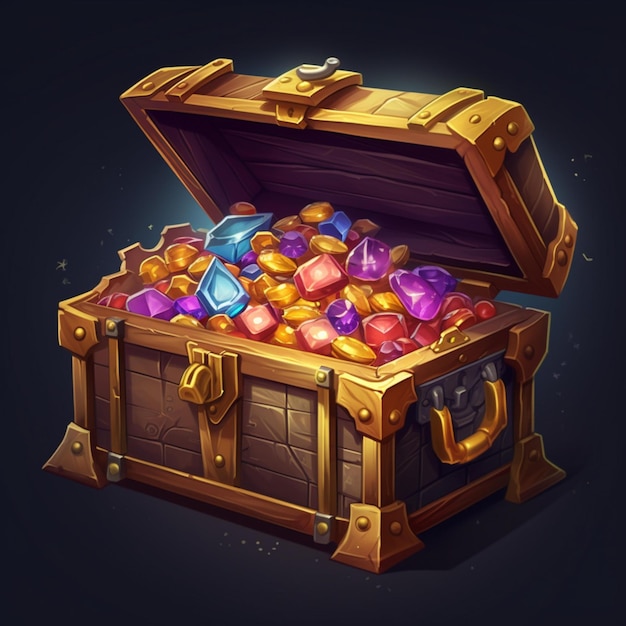
The height and width of the screenshot is (626, 626). Identify the location of handle. (462, 449).